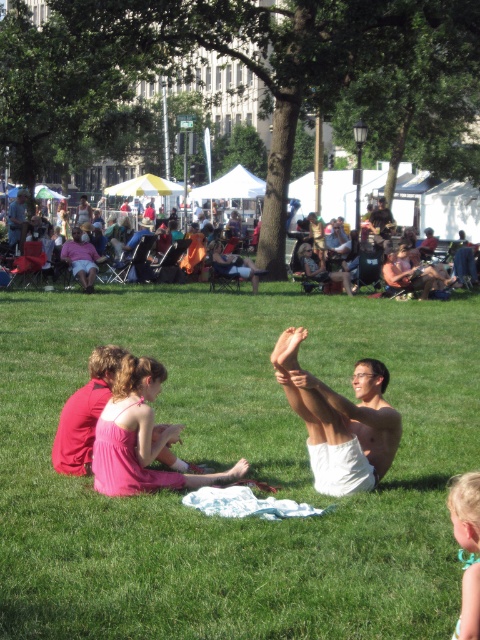
You are standing in the park and see a point marked at coordinates (451, 209). What object is located at that point?

The point at (451, 209) marks the location of the matte orange tent at center.

You are a photographer wanting to capture a photo of the green grass at center and the pink satin dress at lower left. To ensure both are in the frame, which object should you position closer to the camera?

The pink satin dress at lower left should be positioned closer to the camera since the green grass at center is on its right side, meaning it is further away from the photographer.

You are planning to set up a picnic and have a space that can fit the matte orange tent at center. Can the matte pink dress at center also fit in the same space?

The matte orange tent at center might be wider than matte pink dress at center, so there is a possibility that the space allocated for the tent may not be sufficient for the matte pink dress at center as well. It depends on the exact dimensions of both items.